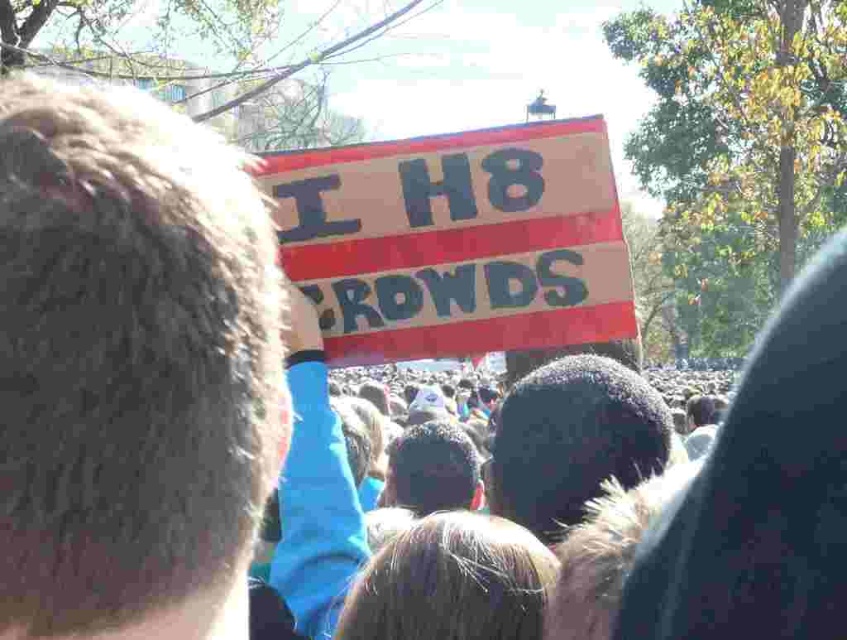
Is wooden sign at center positioned behind brown fur at center?

Yes, it is.

From the picture: Is wooden sign at center smaller than brown fur at center?

No.

This screenshot has height=640, width=847. Find the location of `wooden sign at center`. wooden sign at center is located at coordinates (457, 241).